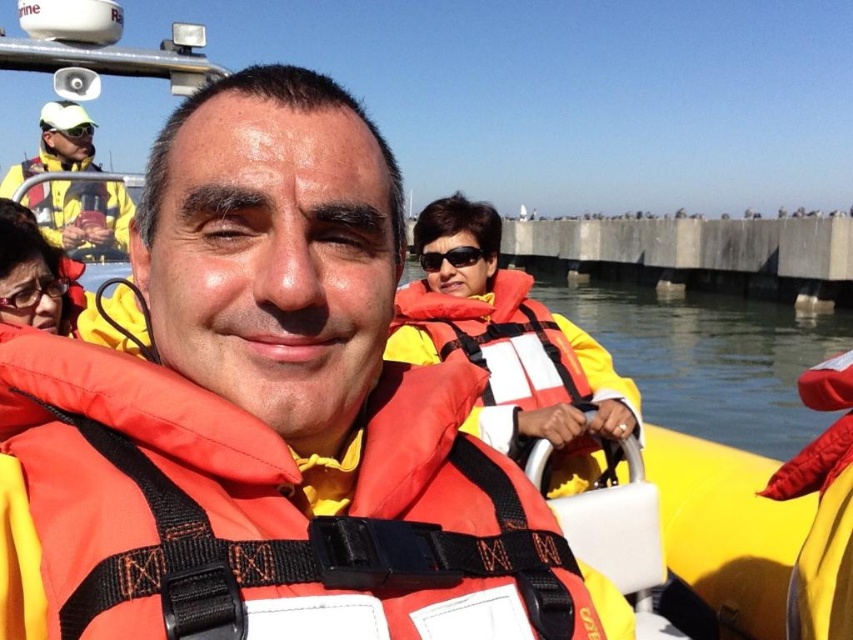
Does orange life vest at center have a greater height compared to black plastic sunglasses at center?

Yes.

Locate an element on the screen. The width and height of the screenshot is (853, 640). orange life vest at center is located at coordinates (706, 358).

Is point (810, 417) farther from camera compared to point (444, 257)?

Yes, point (810, 417) is behind point (444, 257).

Find the location of a particular element. orange life vest at center is located at coordinates (706, 358).

Is the position of orange matte life jacket at center less distant than that of yellow matte jacket at upper left?

Yes, orange matte life jacket at center is closer to the viewer.

Can you confirm if orange matte life jacket at center is taller than yellow matte jacket at upper left?

Yes.

Is point (109, 637) farther from viewer compared to point (126, 227)?

No, it is not.

You are a GUI agent. You are given a task and a screenshot of the screen. Output one action in this format:
    pyautogui.click(x=<x>, y=<y>)
    Task: Click on the orange matte life jacket at center
    Image resolution: width=853 pixels, height=640 pixels.
    Given the screenshot: What is the action you would take?
    pyautogui.click(x=271, y=512)

Who is positioned more to the left, orange matte life jacket at center or orange life jacket at center?

From the viewer's perspective, orange matte life jacket at center appears more on the left side.

Is orange matte life jacket at center taller than orange life jacket at center?

Incorrect, orange matte life jacket at center's height is not larger of orange life jacket at center's.

You are a GUI agent. You are given a task and a screenshot of the screen. Output one action in this format:
    pyautogui.click(x=<x>, y=<y>)
    Task: Click on the orange matte life jacket at center
    The height and width of the screenshot is (640, 853).
    Given the screenshot: What is the action you would take?
    pyautogui.click(x=271, y=512)